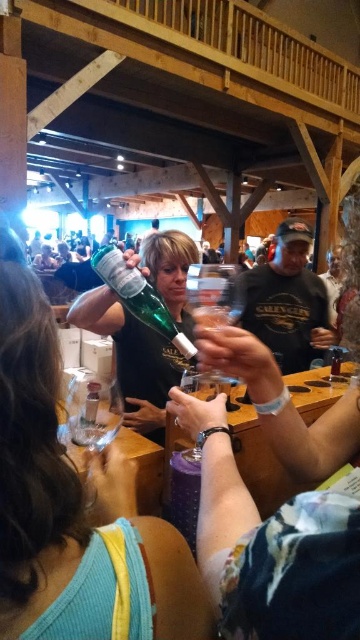
Question: Which of the following is the closest to the observer?

Choices:
 (A) (231, 300)
 (B) (43, 472)
 (C) (123, 289)
 (D) (83, 420)

Answer: (B)

Question: Which object appears closest to the camera in this image?

Choices:
 (A) matte green glass bottle at center
 (B) clear glass bottle at center
 (C) green glass bottle at center
 (D) transparent plastic wine glass at center

Answer: (A)

Question: From the image, what is the correct spatial relationship of matte green glass bottle at center in relation to transparent plastic wine glass at center?

Choices:
 (A) above
 (B) below

Answer: (B)

Question: Which of these objects is positioned closest to the matte green glass bottle at center?

Choices:
 (A) green glass bottle at center
 (B) transparent plastic wine glass at center

Answer: (A)

Question: Is matte green glass bottle at center below clear glass bottle at center?

Choices:
 (A) no
 (B) yes

Answer: (A)

Question: Observing the image, what is the correct spatial positioning of green glass bottle at center in reference to transparent plastic wine glass at center?

Choices:
 (A) right
 (B) left

Answer: (B)